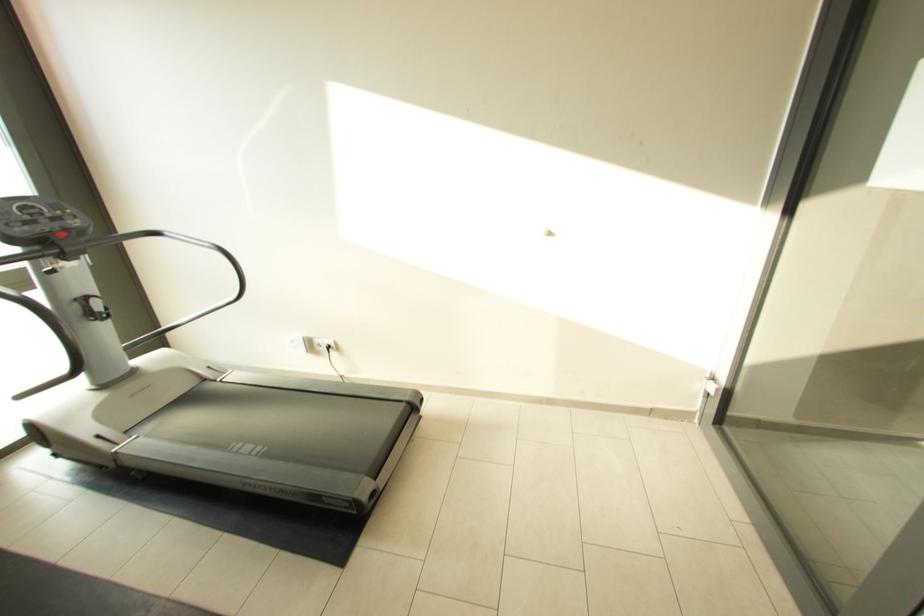
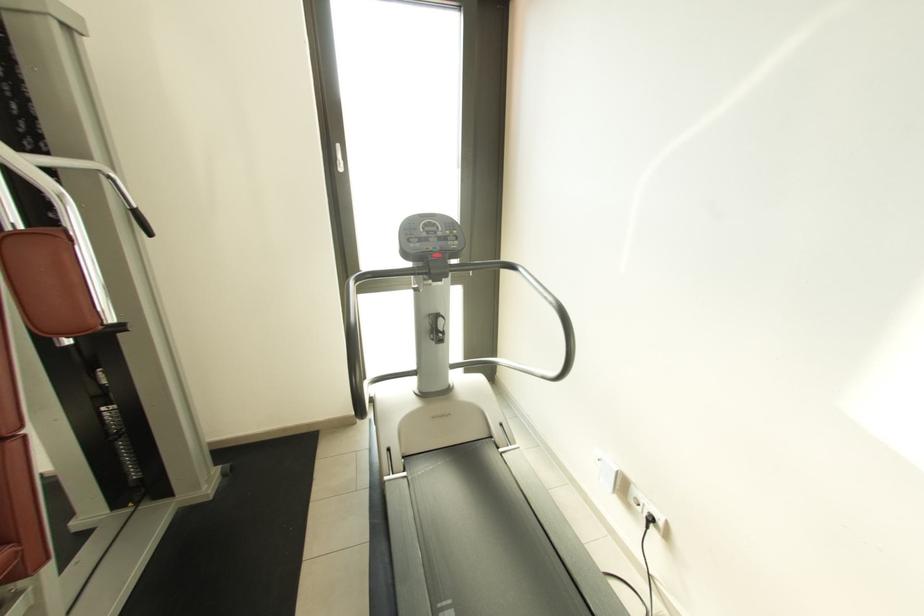
Locate, in the second image, the point that corresponds to [42,213] in the first image.

(439, 230)